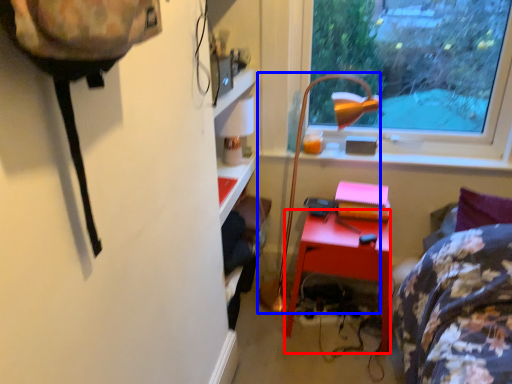
Question: Among these objects, which one is farthest to the camera, desk (highlighted by a red box) or lamp (highlighted by a blue box)?

Choices:
 (A) desk
 (B) lamp

Answer: (A)